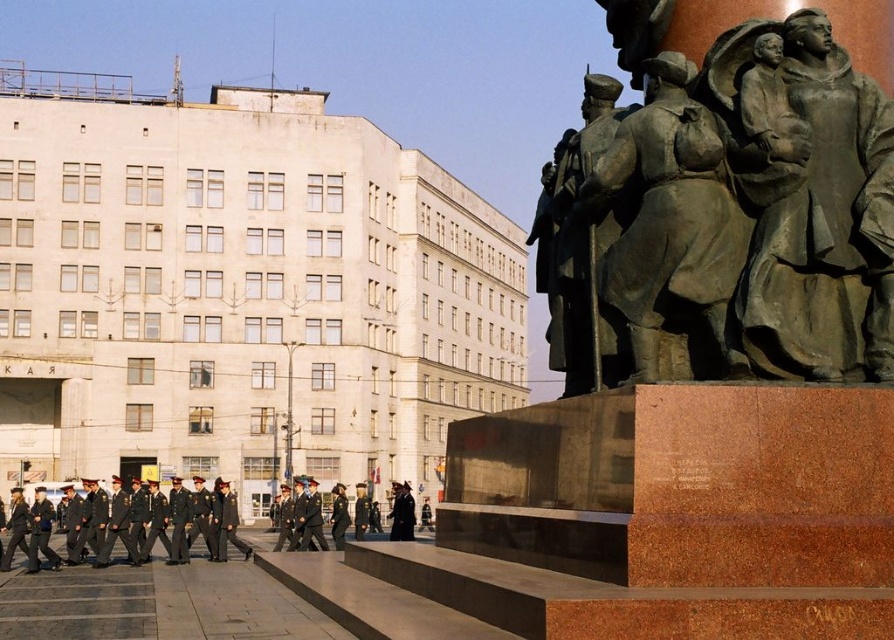
Who is positioned more to the left, bronze sculpture at right or bronze statue at center?

From the viewer's perspective, bronze statue at center appears more on the left side.

Who is lower down, bronze sculpture at right or bronze statue at center?

bronze sculpture at right is lower down.

Describe the element at coordinates (726, 198) in the screenshot. I see `bronze sculpture at right` at that location.

This screenshot has width=894, height=640. I want to click on bronze sculpture at right, so click(726, 198).

Is bronze statue of woman holding child at right positioned in front of dark green uniform at lower left?

Yes, it is in front of dark green uniform at lower left.

Describe the element at coordinates (817, 205) in the screenshot. I see `bronze statue of woman holding child at right` at that location.

Between point (796, 362) and point (58, 516), which one is positioned in front?

Point (796, 362)

The image size is (894, 640). Find the location of `bronze statue of woman holding child at right`. bronze statue of woman holding child at right is located at coordinates (817, 205).

Who is more forward, (536, 276) or (46, 488)?

Positioned in front is point (536, 276).

Does bronze statue at center have a lesser width compared to dark green uniform at lower left?

Yes.

Which is behind, point (550, 321) or point (116, 515)?

The point (116, 515) is behind.

Where is `bronze statue at center`? Image resolution: width=894 pixels, height=640 pixels. bronze statue at center is located at coordinates (579, 248).